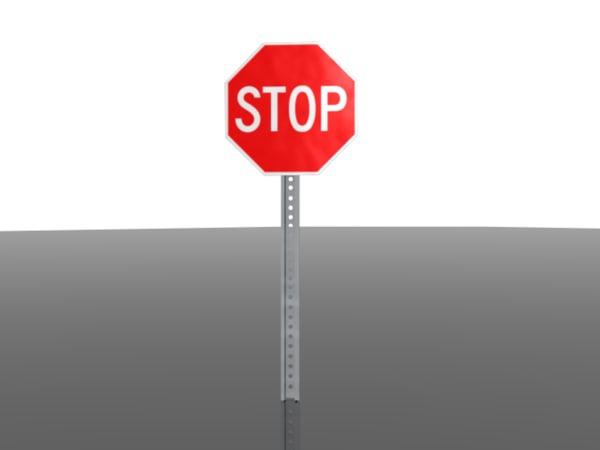
The image size is (600, 450). Find the location of `white trim`. white trim is located at coordinates (295, 174), (226, 101), (331, 56), (342, 151).